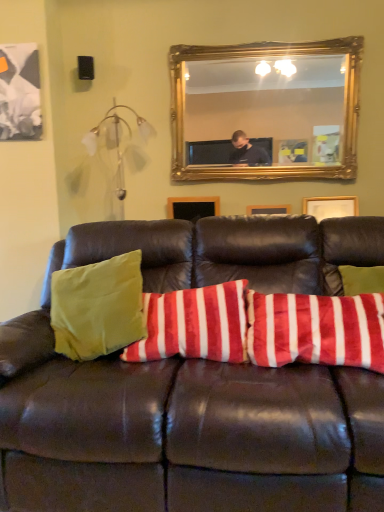
Question: Can you confirm if gold-framed mirror at upper center is thinner than velvety red and white striped pillow at center?

Choices:
 (A) no
 (B) yes

Answer: (B)

Question: Does gold-framed mirror at upper center have a greater width compared to velvety red and white striped pillow at center?

Choices:
 (A) yes
 (B) no

Answer: (B)

Question: Is gold-framed mirror at upper center facing away from velvety red and white striped pillow at center?

Choices:
 (A) no
 (B) yes

Answer: (A)

Question: Can you confirm if gold-framed mirror at upper center is positioned to the left of velvety red and white striped pillow at center?

Choices:
 (A) yes
 (B) no

Answer: (B)

Question: Are gold-framed mirror at upper center and velvety red and white striped pillow at center making contact?

Choices:
 (A) yes
 (B) no

Answer: (B)

Question: Based on their sizes in the image, would you say gold-framed mirror at upper center is bigger or smaller than leather couch at center?

Choices:
 (A) small
 (B) big

Answer: (A)

Question: From their relative heights in the image, would you say gold-framed mirror at upper center is taller or shorter than leather couch at center?

Choices:
 (A) tall
 (B) short

Answer: (B)

Question: From the image's perspective, relative to leather couch at center, is gold-framed mirror at upper center above or below?

Choices:
 (A) above
 (B) below

Answer: (A)

Question: From a real-world perspective, is gold-framed mirror at upper center physically located above or below leather couch at center?

Choices:
 (A) below
 (B) above

Answer: (B)

Question: From the image's perspective, relative to velvety red and white striped pillow at center, is leather couch at center above or below?

Choices:
 (A) above
 (B) below

Answer: (B)

Question: Is leather couch at center situated inside velvety red and white striped pillow at center or outside?

Choices:
 (A) outside
 (B) inside

Answer: (A)

Question: In terms of width, does leather couch at center look wider or thinner when compared to velvety red and white striped pillow at center?

Choices:
 (A) wide
 (B) thin

Answer: (A)

Question: From a real-world perspective, relative to velvety red and white striped pillow at center, is leather couch at center vertically above or below?

Choices:
 (A) above
 (B) below

Answer: (B)

Question: Does point (382, 419) appear closer or farther from the camera than point (269, 79)?

Choices:
 (A) farther
 (B) closer

Answer: (B)

Question: From a real-world perspective, relative to gold-framed mirror at upper center, is leather couch at center vertically above or below?

Choices:
 (A) above
 (B) below

Answer: (B)